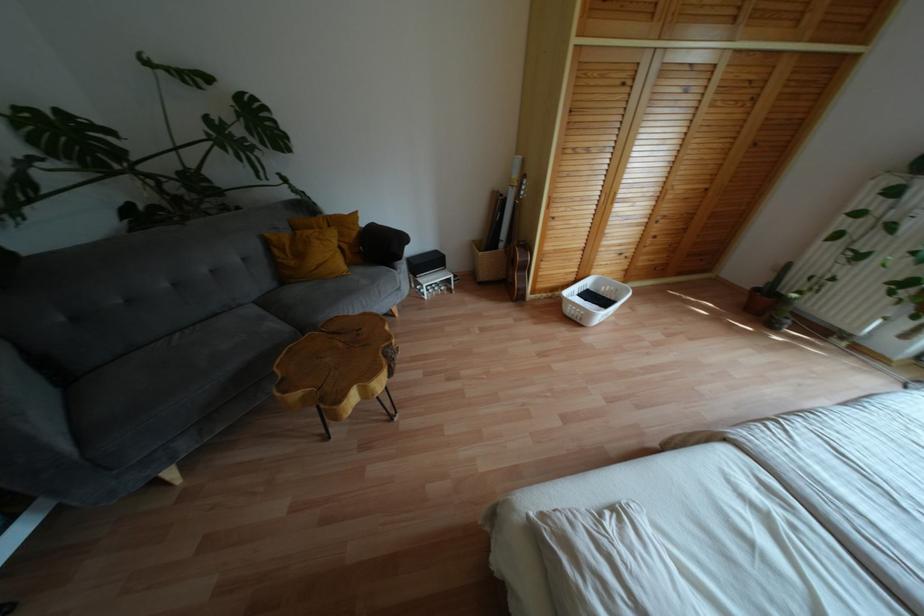
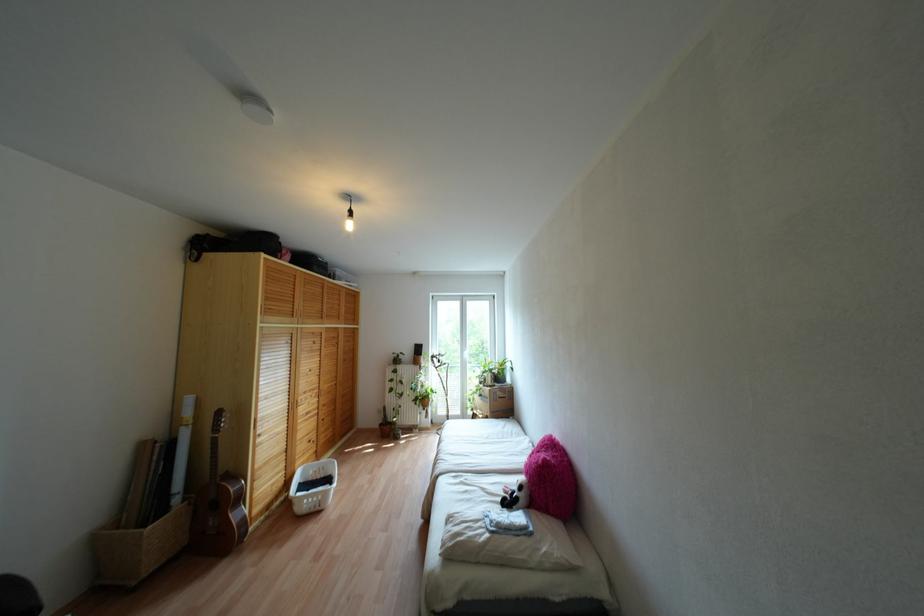
The point at (626, 217) is marked in the first image. Where is the corresponding point in the second image?

(307, 413)